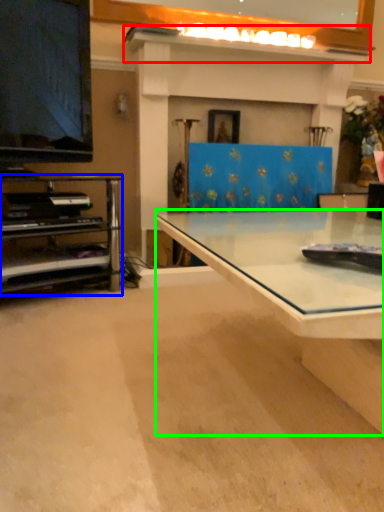
Question: Estimate the real-world distances between objects in this image. Which object is closer to mantle (highlighted by a red box), shelf (highlighted by a blue box) or desk (highlighted by a green box)?

Choices:
 (A) shelf
 (B) desk

Answer: (A)